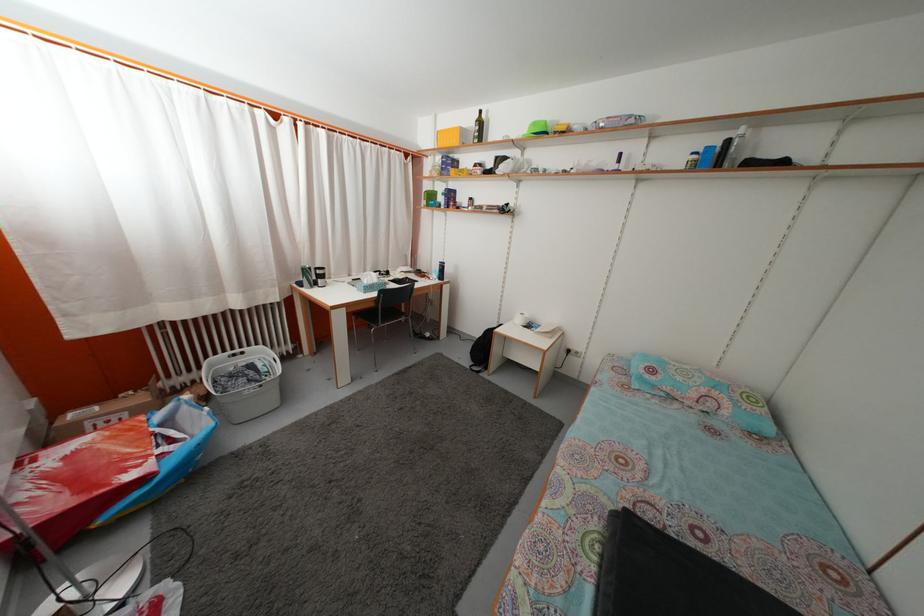
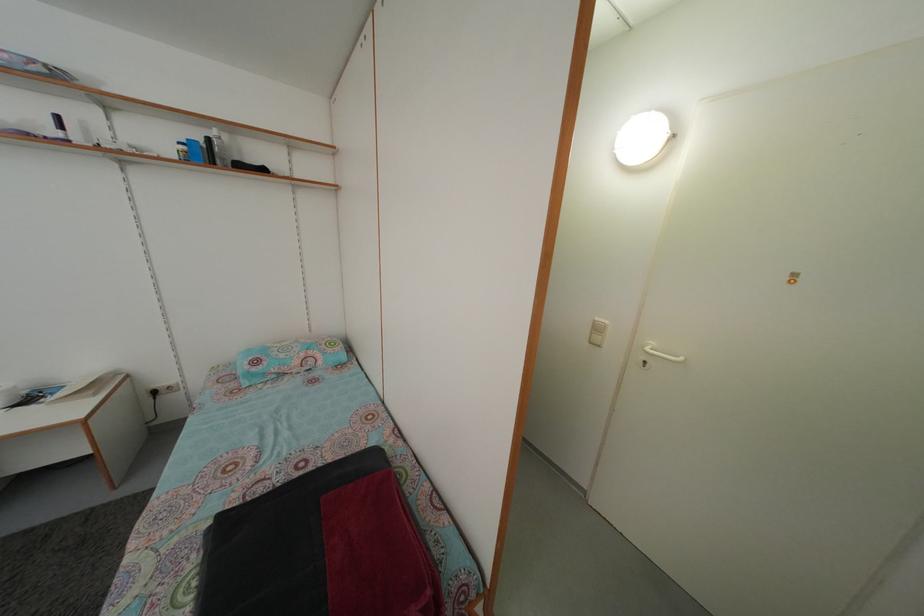
Question: The first image is from the beginning of the video and the second image is from the end. How did the camera likely rotate when shooting the video?

Choices:
 (A) Left
 (B) Right
 (C) Up
 (D) Down

Answer: (B)